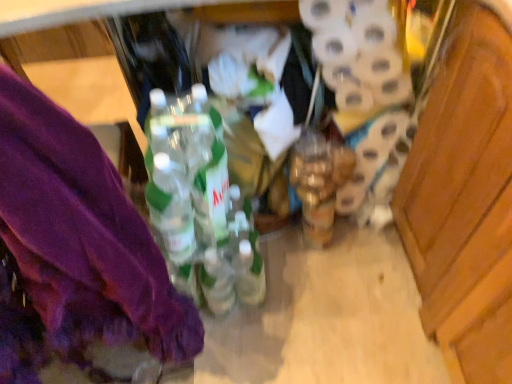
Question: Considering the positions of white matte toilet paper at center right and translucent plastic bottles at center in the image, is white matte toilet paper at center right taller or shorter than translucent plastic bottles at center?

Choices:
 (A) short
 (B) tall

Answer: (A)

Question: Which is correct: white matte toilet paper at center right is inside translucent plastic bottles at center, or outside of it?

Choices:
 (A) outside
 (B) inside

Answer: (A)

Question: Which object is the farthest from the purple fabric at left?

Choices:
 (A) translucent plastic bottles at center
 (B) white matte toilet paper at center right

Answer: (B)

Question: Which object is positioned farthest from the white matte toilet paper at center right?

Choices:
 (A) translucent plastic bottles at center
 (B) purple fabric at left

Answer: (B)